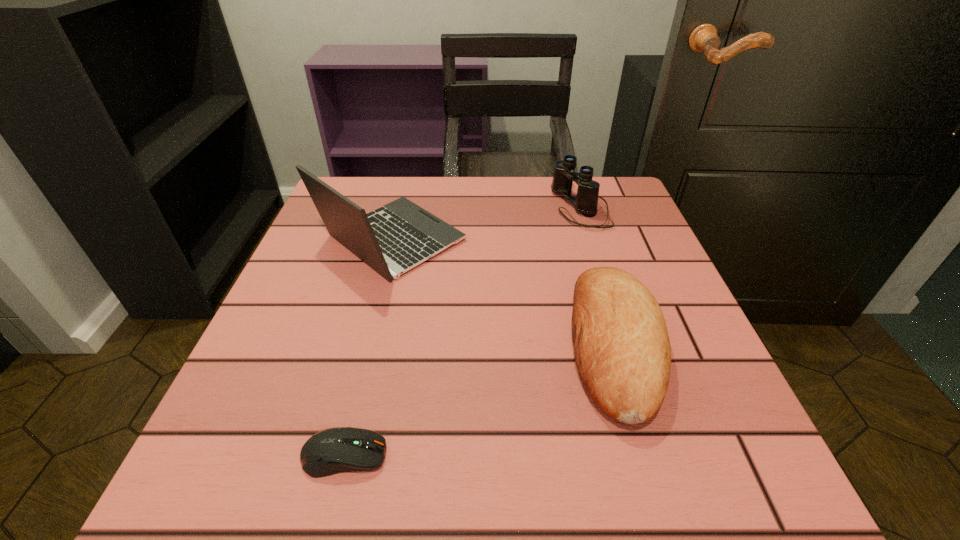
Locate an element on the screen. object that is at the near edge is located at coordinates (335, 450).

Identify the location of laptop_computer that is at the left edge. The height and width of the screenshot is (540, 960). (393, 239).

The image size is (960, 540). What are the coordinates of `computer equipment that is at the left edge` in the screenshot? It's located at (335, 450).

Find the location of a particular element. The height and width of the screenshot is (540, 960). binoculars located in the right edge section of the desktop is located at coordinates (586, 201).

Locate an element on the screen. This screenshot has width=960, height=540. bread that is at the right edge is located at coordinates (622, 350).

Identify the location of object at the far left corner. The height and width of the screenshot is (540, 960). (393, 239).

At what (x,y) coordinates should I click in order to perform the action: click on object located at the near left corner. Please return your answer as a coordinate pair (x, y). Image resolution: width=960 pixels, height=540 pixels. Looking at the image, I should click on (335, 450).

The height and width of the screenshot is (540, 960). I want to click on object that is positioned at the far right corner, so (x=586, y=201).

The image size is (960, 540). Find the location of `free space at the far edge`. free space at the far edge is located at coordinates (522, 204).

At what (x,y) coordinates should I click in order to perform the action: click on free space at the near edge. Please return your answer as a coordinate pair (x, y). The image size is (960, 540). Looking at the image, I should click on (468, 490).